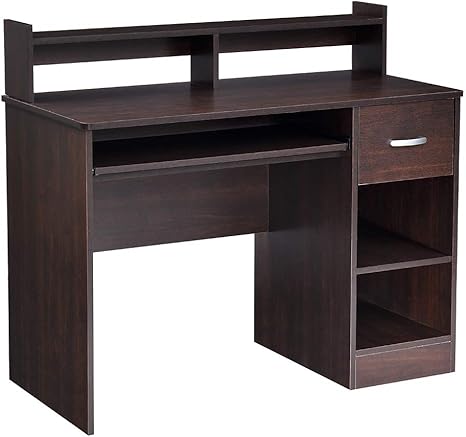
At what (x,y) coordinates should I click in order to perform the action: click on silver handle. Please return your answer as a coordinate pair (x, y). This screenshot has height=437, width=466. Looking at the image, I should click on (409, 143).